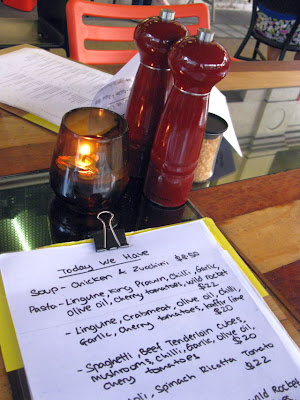
Image resolution: width=300 pixels, height=400 pixels. In order to click on yellow clipboard in this screenshot , I will do `click(32, 117)`, `click(13, 345)`.